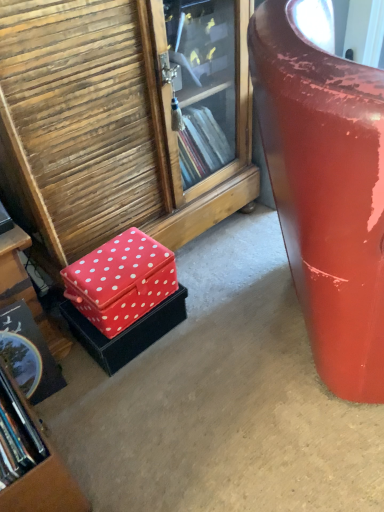
In order to click on vacant area that lies between glossy red suitcase at right and red fabric box at lower left, which ranks as the first box in bottom-to-top order in this screenshot , I will do `click(208, 332)`.